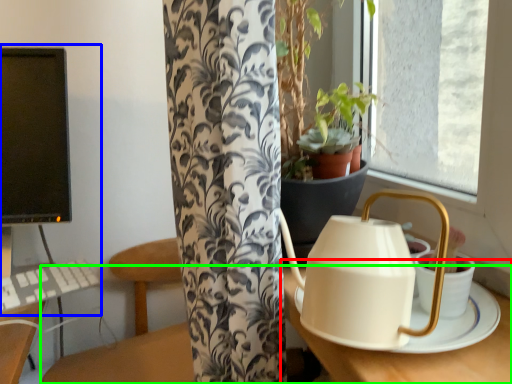
Question: Considering the real-world distances, which object is closest to round table (highlighted by a red box)? desktop computer (highlighted by a blue box) or table (highlighted by a green box).

Choices:
 (A) desktop computer
 (B) table

Answer: (B)